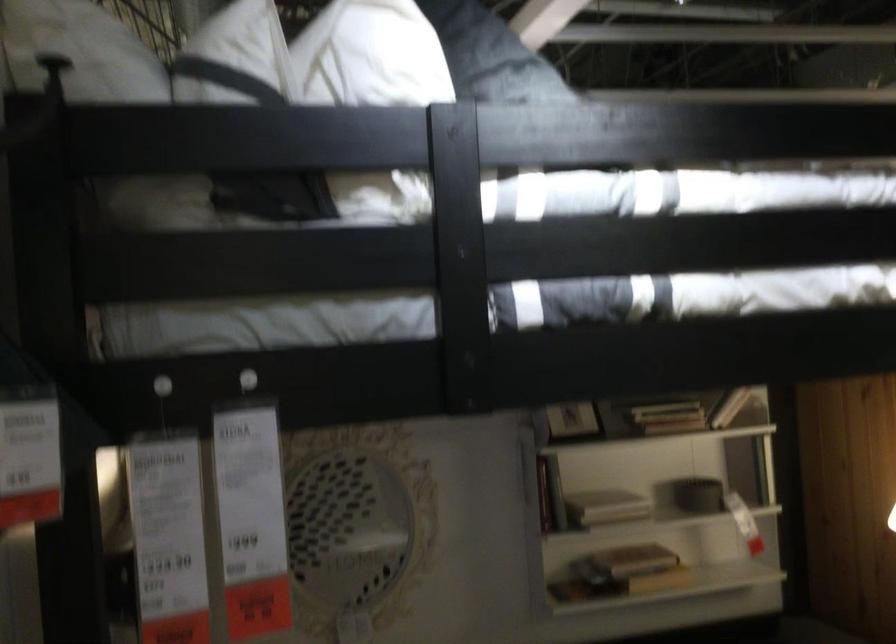
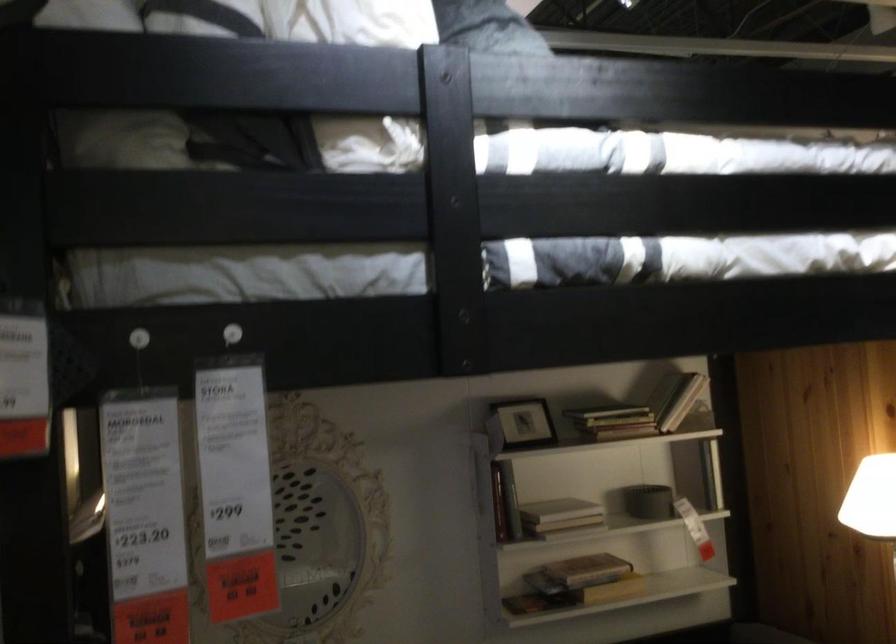
In the second image, find the point that corresponds to (x=572, y=419) in the first image.

(522, 422)